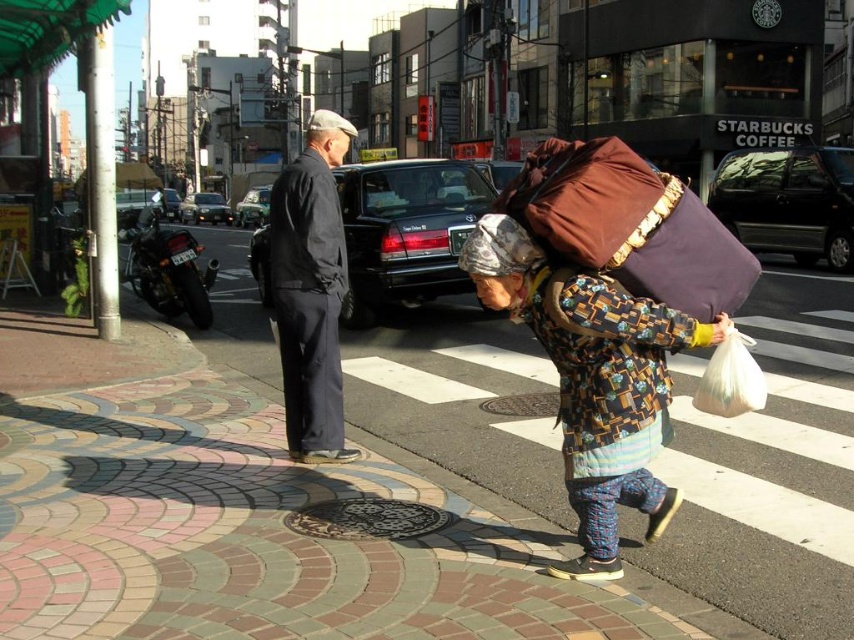
Between point (335, 141) and point (308, 132), which one is positioned in front?

Point (335, 141)

What do you see at coordinates (309, 291) in the screenshot?
I see `dark blue suit at center` at bounding box center [309, 291].

Locate an element on the screen. This screenshot has height=640, width=854. dark blue suit at center is located at coordinates (309, 291).

Which of these two, printed fabric bag at center or matte gray cap at upper center, stands shorter?

printed fabric bag at center is shorter.

Which is in front, point (597, 538) or point (323, 148)?

Positioned in front is point (597, 538).

Find the location of a particular element. The width and height of the screenshot is (854, 640). printed fabric bag at center is located at coordinates (594, 380).

Can you confirm if dark blue suit at center is smaller than camouflage fabric headscarf at center?

No.

Measure the distance between point (332, 237) and camera.

A distance of 15.39 feet exists between point (332, 237) and camera.

This screenshot has height=640, width=854. Identify the location of dark blue suit at center. (309, 291).